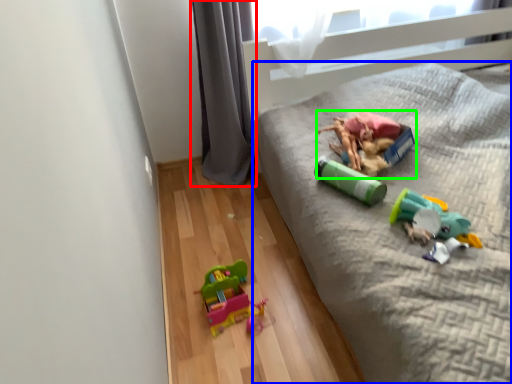
Question: Considering the real-world distances, which object is closest to curtain (highlighted by a red box)? furniture (highlighted by a blue box) or toy (highlighted by a green box).

Choices:
 (A) furniture
 (B) toy

Answer: (A)